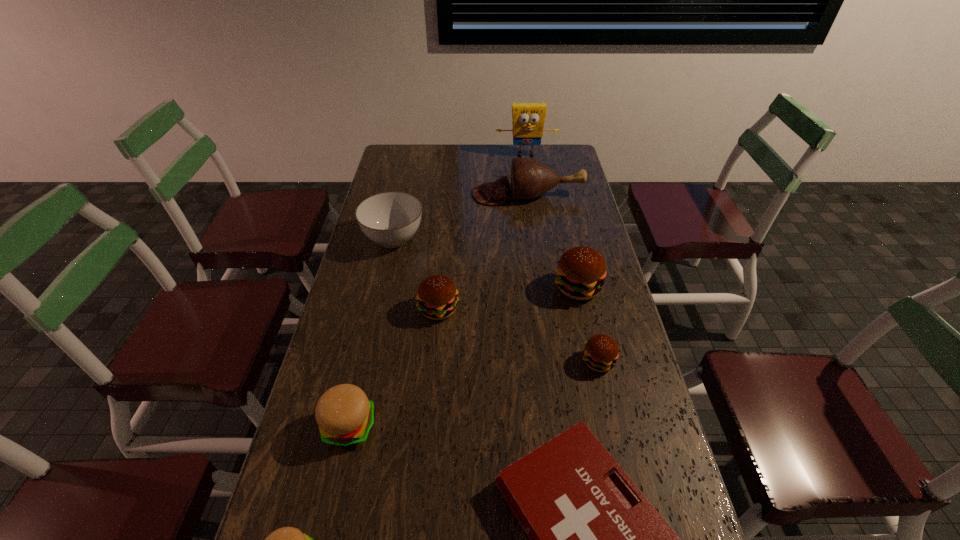
Locate which hamburger ranks fourth in proximity to the biggest brown hamburger. Please provide its 2D coordinates. Your answer should be formatted as a tuple, i.e. [(x, y)], where the tuple contains the x and y coordinates of a point satisfying the conditions above.

[(286, 539)]

Find the location of `brown hamburger that stands as the second closest to the nearest hamburger`. brown hamburger that stands as the second closest to the nearest hamburger is located at coordinates (600, 354).

Identify which brown hamburger is the second closest to the nearest brown hamburger. Please provide its 2D coordinates. Your answer should be formatted as a tuple, i.e. [(x, y)], where the tuple contains the x and y coordinates of a point satisfying the conditions above.

[(437, 297)]

I want to click on free space that satisfies the following two spatial constraints: 1. on the back side of the tallest hamburger; 2. at the sliced end of the ham, so click(x=557, y=194).